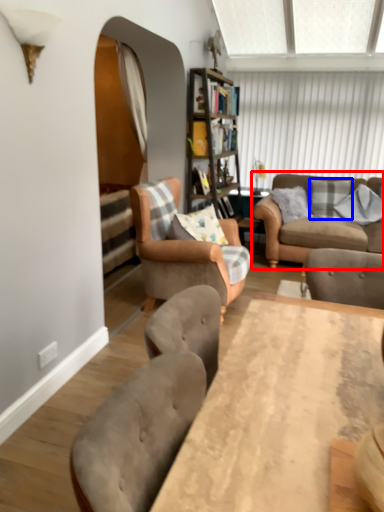
Question: Which object is further to the camera taking this photo, studio couch (highlighted by a red box) or pillow (highlighted by a blue box)?

Choices:
 (A) studio couch
 (B) pillow

Answer: (B)